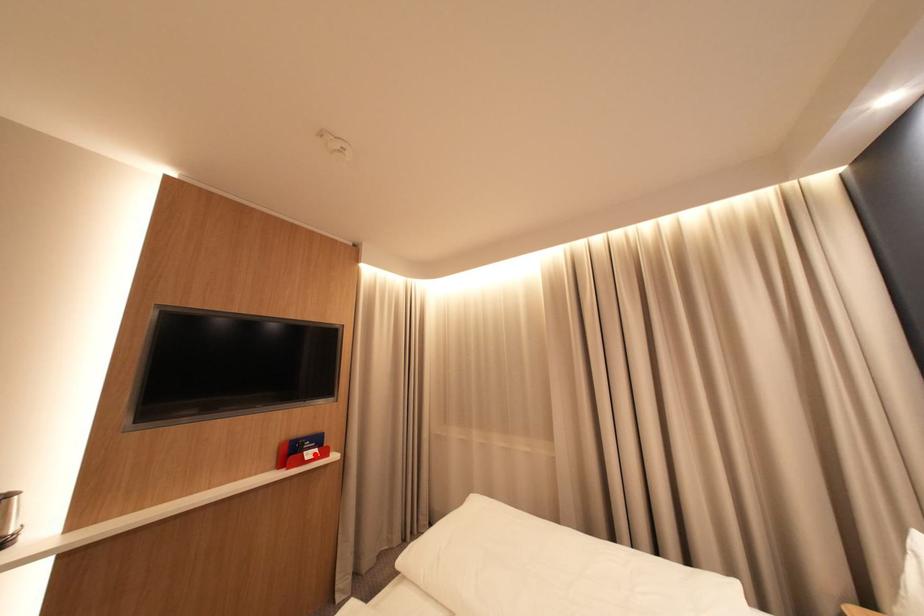
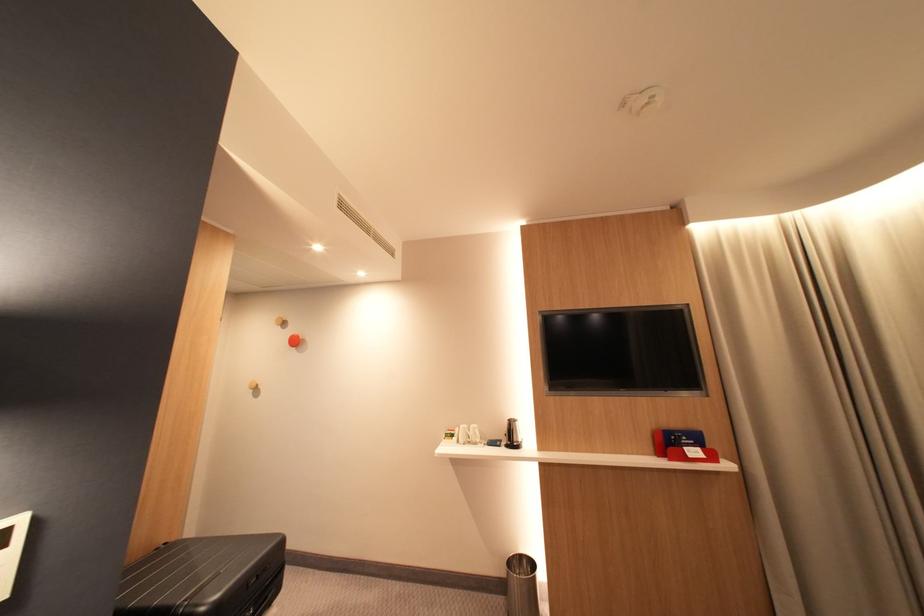
In the second image, find the point that corresponds to the highlighted location in the first image.

(696, 450)